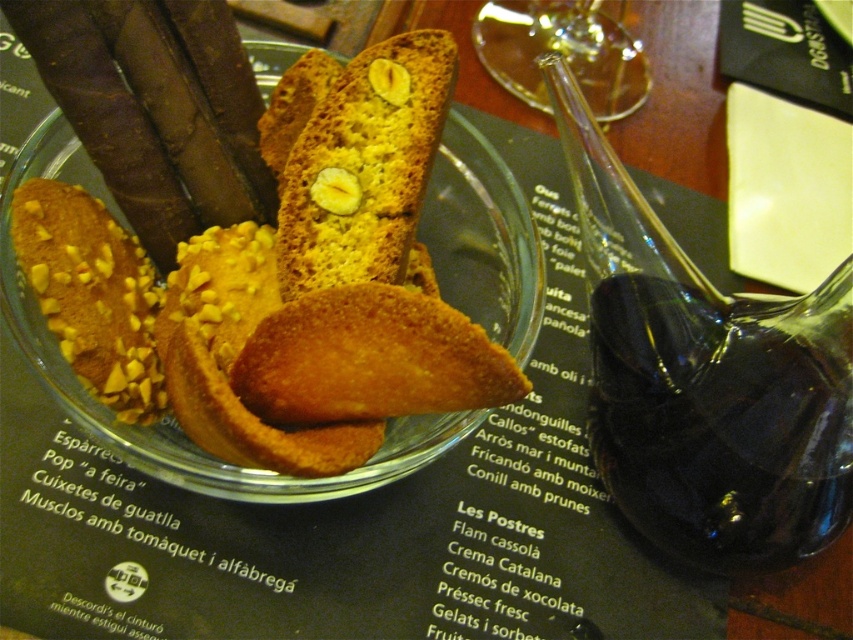
Question: Observing the image, what is the correct spatial positioning of golden crumbly biscuit at center in reference to golden crumbly biscotti at center?

Choices:
 (A) left
 (B) right

Answer: (A)

Question: Estimate the real-world distances between objects in this image. Which object is farther from the golden crumbly biscuit at center?

Choices:
 (A) golden crumbly biscotti at center
 (B) transparent glass at upper center

Answer: (B)

Question: Estimate the real-world distances between objects in this image. Which object is farther from the transparent glass at upper center?

Choices:
 (A) golden crumbly biscuit at center
 (B) golden crumbly biscotti at center

Answer: (A)

Question: Can you confirm if golden crumbly biscuit at center is thinner than golden crumbly biscotti at center?

Choices:
 (A) yes
 (B) no

Answer: (B)

Question: Can you confirm if golden crumbly biscuit at center is wider than golden crumbly biscotti at center?

Choices:
 (A) yes
 (B) no

Answer: (A)

Question: Which point is closer to the camera taking this photo?

Choices:
 (A) (459, 316)
 (B) (347, 65)

Answer: (A)